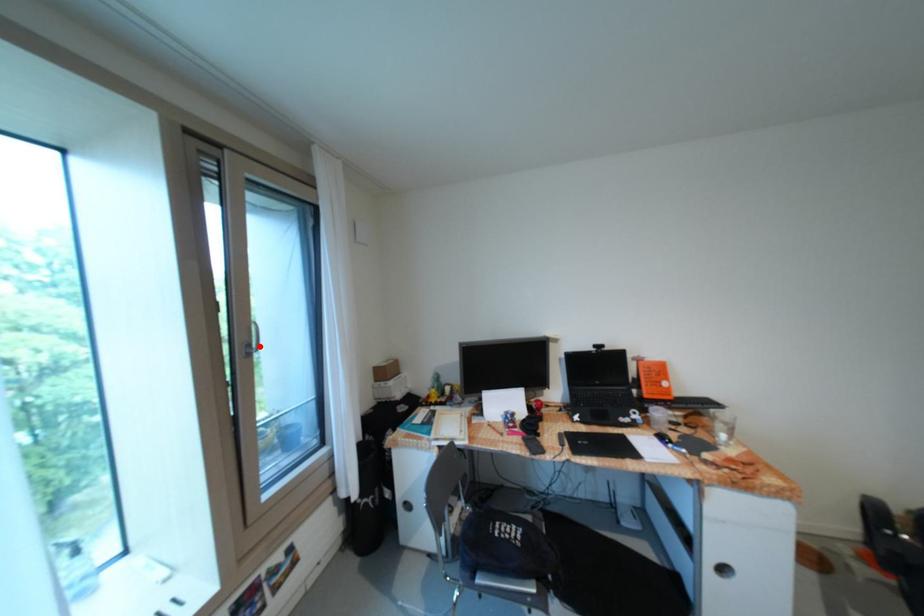
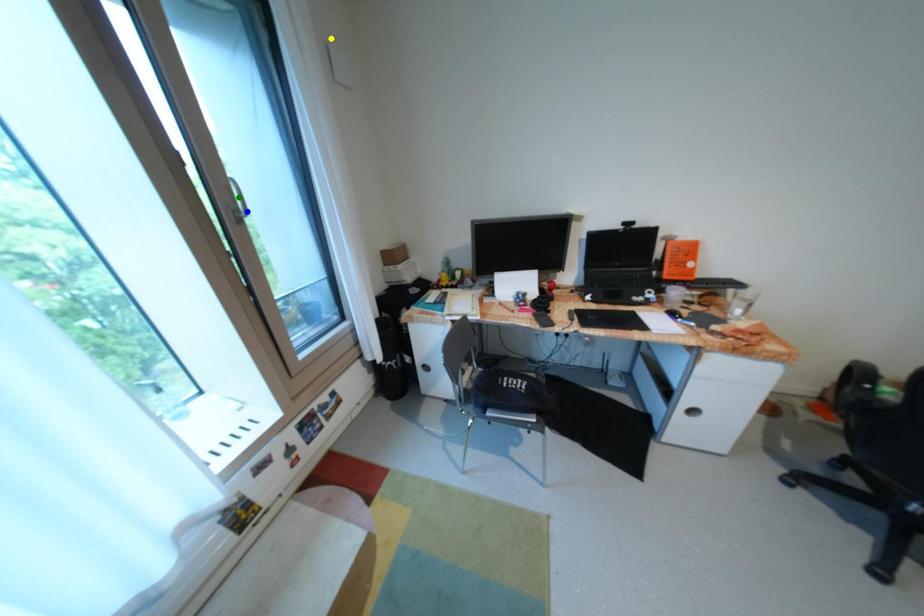
Question: I am providing you with two images of the same scene from different viewpoints. A red point is marked on the first image. You are given multiple points on the second image. In image 2, which mark is for the same physical point as the one in image 1?

Choices:
 (A) green point
 (B) yellow point
 (C) blue point

Answer: (C)